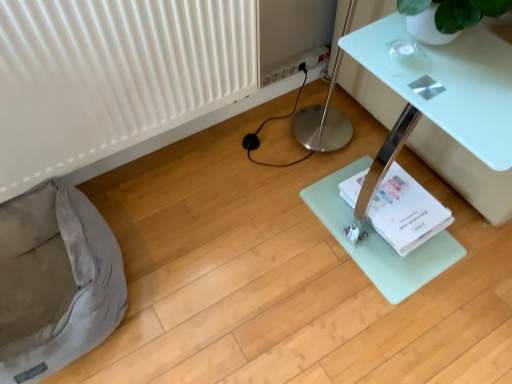
Question: In terms of height, does white paper at lower right look taller or shorter compared to white glossy table at lower right?

Choices:
 (A) short
 (B) tall

Answer: (A)

Question: In terms of size, does white paper at lower right appear bigger or smaller than white glossy table at lower right?

Choices:
 (A) big
 (B) small

Answer: (B)

Question: Estimate the real-world distances between objects in this image. Which object is closer to the white ribbed radiator at lower left?

Choices:
 (A) white glossy table at lower right
 (B) white paper at lower right
 (C) white plastic power strip at upper center
 (D) gray fabric bean bag at lower left

Answer: (D)

Question: Which of these objects is positioned closest to the white plastic power strip at upper center?

Choices:
 (A) white ribbed radiator at lower left
 (B) white paper at lower right
 (C) white glossy table at lower right
 (D) gray fabric bean bag at lower left

Answer: (C)